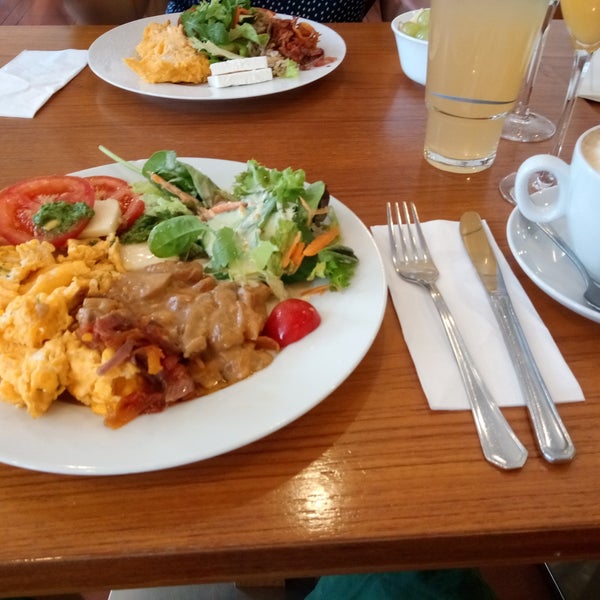
In order to click on tabletop in this screenshot , I will do `click(399, 460)`.